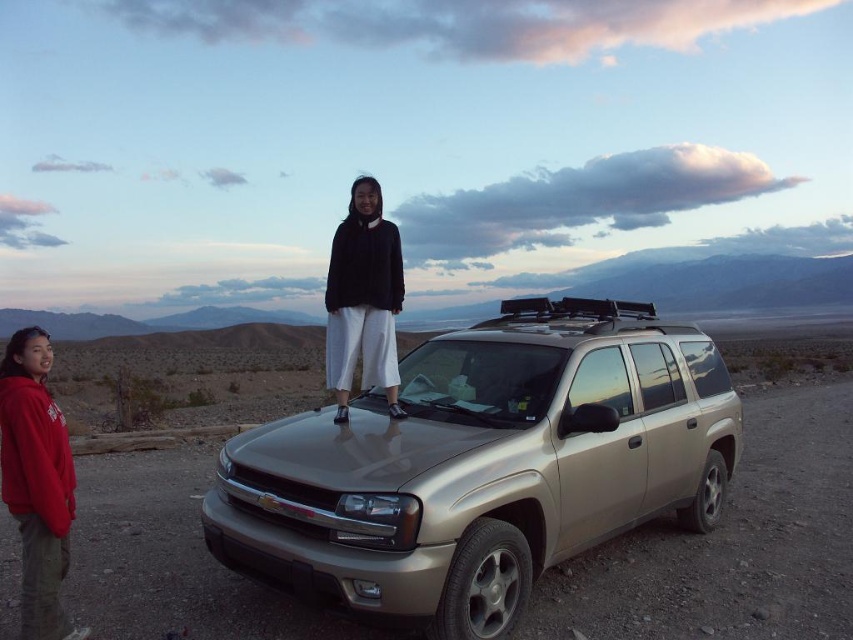
Can you confirm if red fleece jacket at lower left is smaller than black matte sweater at center?

No, red fleece jacket at lower left is not smaller than black matte sweater at center.

Find the location of `red fleece jacket at lower left`. red fleece jacket at lower left is located at coordinates (36, 483).

Identify the location of red fleece jacket at lower left. The width and height of the screenshot is (853, 640). (36, 483).

Does satin gold suv at center have a greater width compared to red fleece jacket at lower left?

Correct, the width of satin gold suv at center exceeds that of red fleece jacket at lower left.

Who is more distant from viewer, [413,582] or [57,451]?

Positioned behind is point [57,451].

The width and height of the screenshot is (853, 640). What are the coordinates of `satin gold suv at center` in the screenshot? It's located at (483, 465).

Between satin gold suv at center and black matte sweater at center, which one appears on the right side from the viewer's perspective?

Positioned to the right is satin gold suv at center.

Can you confirm if satin gold suv at center is thinner than black matte sweater at center?

No.

What do you see at coordinates (483, 465) in the screenshot? The width and height of the screenshot is (853, 640). I see `satin gold suv at center` at bounding box center [483, 465].

Identify the location of satin gold suv at center. point(483,465).